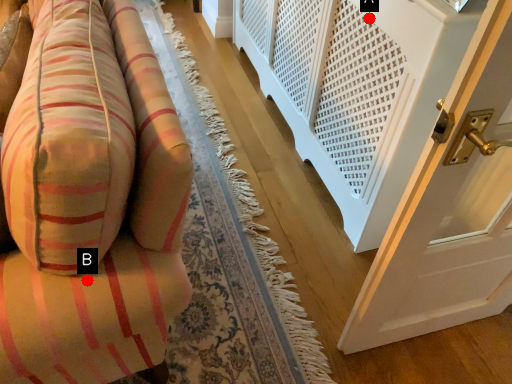
Question: Two points are circled on the image, labeled by A and B beside each circle. Which point is closer to the camera taking this photo?

Choices:
 (A) A is closer
 (B) B is closer

Answer: (B)